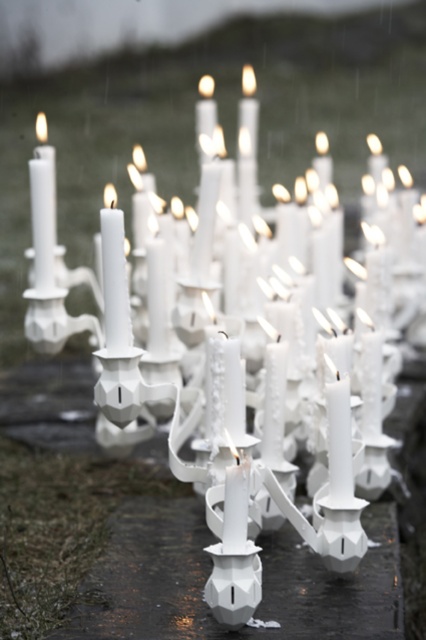
You are standing at the origin point of the coordinate system in the image. You want to place a new candle exactly 0.1 units to the right of the white matte candle at center. What are the coordinates of the new candle?

The white matte candle at center is located at point (115, 282). Adding 0.1 to the x coordinate gives 0.542, so the new candle should be placed at coordinates (115, 346).